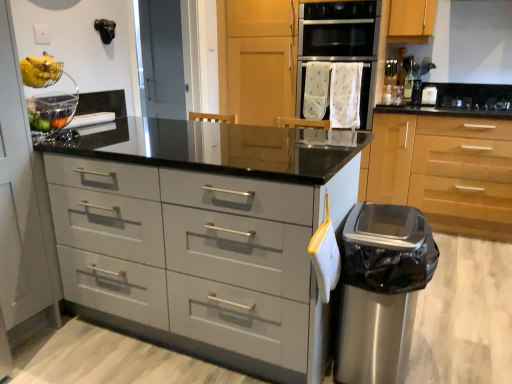
Question: Does point (475, 104) appear closer or farther from the camera than point (388, 264)?

Choices:
 (A) farther
 (B) closer

Answer: (A)

Question: In the image, is black glass gas stove at upper right positioned in front of or behind stainless steel trash can at lower right?

Choices:
 (A) front
 (B) behind

Answer: (B)

Question: Based on their relative distances, which object is nearer to the yellow matte bananas at upper left?

Choices:
 (A) black glass gas stove at upper right
 (B) matte gray drawers at center
 (C) white fabric oven at center
 (D) stainless steel trash can at lower right
 (E) satin black oven at upper center

Answer: (B)

Question: Which of these objects is positioned closest to the black glass gas stove at upper right?

Choices:
 (A) wooden cabinet at right
 (B) satin black oven at upper center
 (C) white fabric oven at center
 (D) stainless steel trash can at lower right
 (E) matte gray drawers at center

Answer: (B)